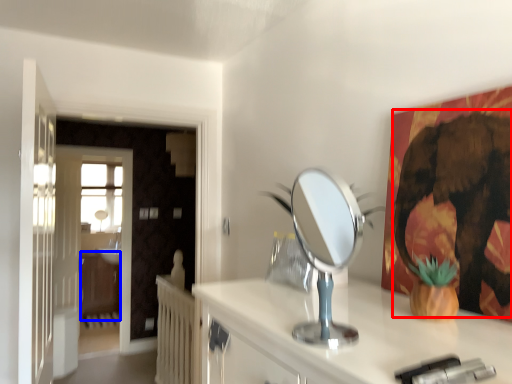
Question: Which of the following is the closest to the observer, elephant (highlighted by a red box) or dresser (highlighted by a blue box)?

Choices:
 (A) elephant
 (B) dresser

Answer: (A)